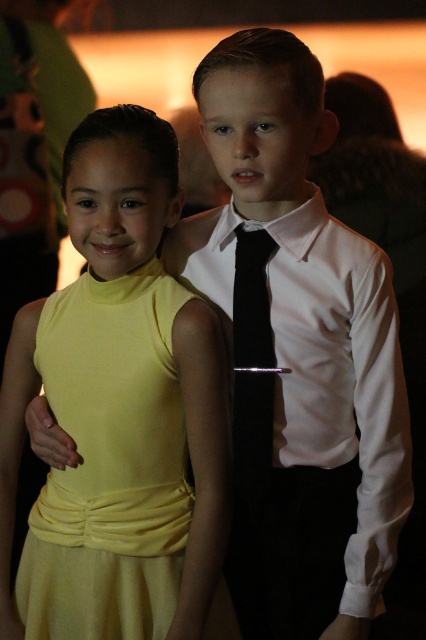
Does point (123, 300) come behind point (253, 420)?

Yes.

The height and width of the screenshot is (640, 426). I want to click on matte yellow dress at center, so click(x=120, y=413).

Between matte yellow dress at center and white smooth dress shirt at center, which one appears on the right side from the viewer's perspective?

Positioned to the right is white smooth dress shirt at center.

Is matte yellow dress at center behind white smooth dress shirt at center?

No, it is not.

Is point (134, 260) closer to camera compared to point (359, 308)?

No.

Where is `matte yellow dress at center`? matte yellow dress at center is located at coordinates (120, 413).

Which is behind, point (345, 340) or point (244, 426)?

The point (244, 426) is behind.

Locate an element on the screen. white smooth dress shirt at center is located at coordinates (324, 364).